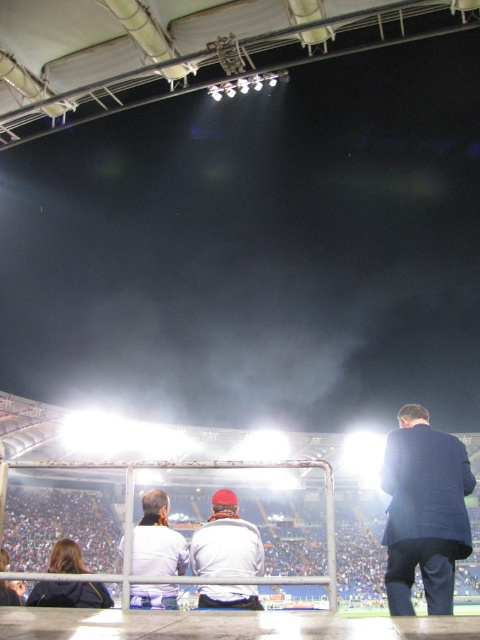
Question: Considering the relative positions of dark blue suit at right and white matte jacket at center in the image provided, where is dark blue suit at right located with respect to white matte jacket at center?

Choices:
 (A) left
 (B) right

Answer: (B)

Question: Does white matte jacket at center appear under white fabric jacket at center?

Choices:
 (A) no
 (B) yes

Answer: (A)

Question: Among these points, which one is nearest to the camera?

Choices:
 (A) (231, 573)
 (B) (169, 598)
 (C) (418, 477)

Answer: (C)

Question: Considering the real-world distances, which object is closest to the white fabric jacket at center?

Choices:
 (A) white matte jacket at center
 (B) dark blue suit at right

Answer: (A)

Question: Which point is farther to the camera?

Choices:
 (A) white matte jacket at center
 (B) white fabric jacket at center
 (C) dark blue suit at right

Answer: (C)

Question: Observing the image, what is the correct spatial positioning of white matte jacket at center in reference to white fabric jacket at center?

Choices:
 (A) above
 (B) below

Answer: (A)